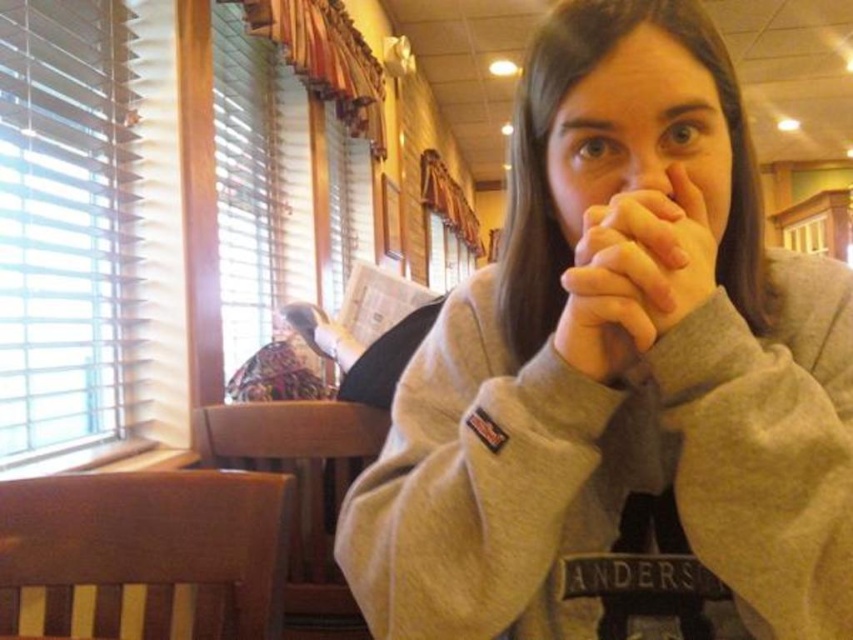
Can you confirm if smooth skin hands at center is positioned to the left of matte skin nose at center?

Indeed, smooth skin hands at center is positioned on the left side of matte skin nose at center.

What do you see at coordinates (634, 275) in the screenshot?
I see `smooth skin hands at center` at bounding box center [634, 275].

Is point (576, 259) behind point (633, 184)?

No, (576, 259) is in front of (633, 184).

The image size is (853, 640). In order to click on smooth skin hands at center in this screenshot , I will do point(634,275).

Consider the image. Which is more to the right, gray fleece sweatshirt at center or matte skin nose at center?

From the viewer's perspective, matte skin nose at center appears more on the right side.

Does gray fleece sweatshirt at center have a lesser width compared to matte skin nose at center?

Incorrect, gray fleece sweatshirt at center's width is not less than matte skin nose at center's.

Is point (648, 390) positioned behind point (637, 145)?

Yes, point (648, 390) is farther from viewer.

I want to click on gray fleece sweatshirt at center, so click(619, 380).

Does gray fleece sweatshirt at center come in front of smooth skin hands at center?

Yes, gray fleece sweatshirt at center is in front of smooth skin hands at center.

Which of these two, gray fleece sweatshirt at center or smooth skin hands at center, stands shorter?

With less height is smooth skin hands at center.

At what (x,y) coordinates should I click in order to perform the action: click on gray fleece sweatshirt at center. Please return your answer as a coordinate pair (x, y). Looking at the image, I should click on (619, 380).